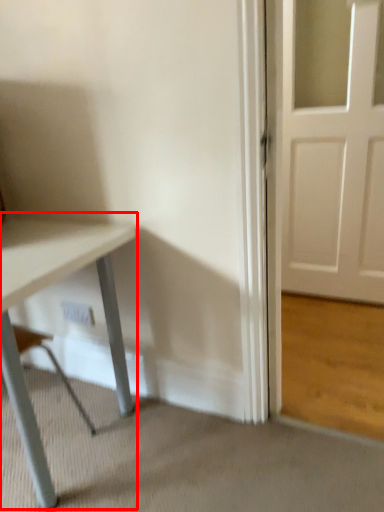
Question: From the image's perspective, where is table (annotated by the red box) located in relation to electric outlet in the image?

Choices:
 (A) below
 (B) above

Answer: (A)